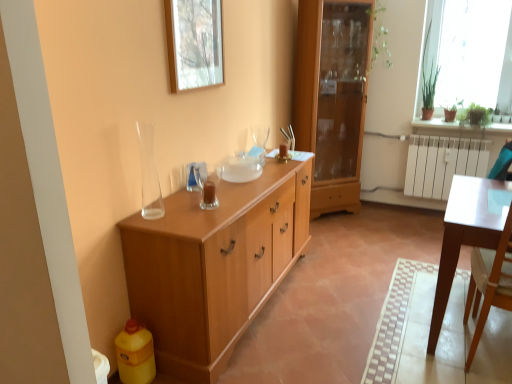
Question: Does light brown wood cabinet at center come behind wooden picture frame at upper center?

Choices:
 (A) yes
 (B) no

Answer: (A)

Question: Can you confirm if light brown wood cabinet at center is taller than wooden picture frame at upper center?

Choices:
 (A) no
 (B) yes

Answer: (B)

Question: Is light brown wood cabinet at center thinner than wooden picture frame at upper center?

Choices:
 (A) yes
 (B) no

Answer: (B)

Question: From the image's perspective, is light brown wood cabinet at center below wooden picture frame at upper center?

Choices:
 (A) yes
 (B) no

Answer: (A)

Question: Is light brown wood cabinet at center positioned before wooden picture frame at upper center?

Choices:
 (A) no
 (B) yes

Answer: (A)

Question: In terms of size, does wooden picture frame at upper center appear bigger or smaller than white glossy table at right?

Choices:
 (A) big
 (B) small

Answer: (B)

Question: Is wooden picture frame at upper center spatially inside white glossy table at right, or outside of it?

Choices:
 (A) outside
 (B) inside

Answer: (A)

Question: From a real-world perspective, is wooden picture frame at upper center above or below white glossy table at right?

Choices:
 (A) above
 (B) below

Answer: (A)

Question: From the image's perspective, is wooden picture frame at upper center above or below white glossy table at right?

Choices:
 (A) below
 (B) above

Answer: (B)

Question: Is light brown wood cabinet at center inside or outside of wooden picture frame at upper center?

Choices:
 (A) outside
 (B) inside

Answer: (A)

Question: From a real-world perspective, is light brown wood cabinet at center positioned above or below wooden picture frame at upper center?

Choices:
 (A) below
 (B) above

Answer: (A)

Question: Considering the positions of light brown wood cabinet at center and wooden picture frame at upper center in the image, is light brown wood cabinet at center taller or shorter than wooden picture frame at upper center?

Choices:
 (A) tall
 (B) short

Answer: (A)

Question: In terms of size, does light brown wood cabinet at center appear bigger or smaller than wooden picture frame at upper center?

Choices:
 (A) small
 (B) big

Answer: (B)

Question: Would you say transparent glass vase at left is inside or outside wooden cabinet at center?

Choices:
 (A) outside
 (B) inside

Answer: (A)

Question: From a real-world perspective, is transparent glass vase at left physically located above or below wooden cabinet at center?

Choices:
 (A) above
 (B) below

Answer: (A)